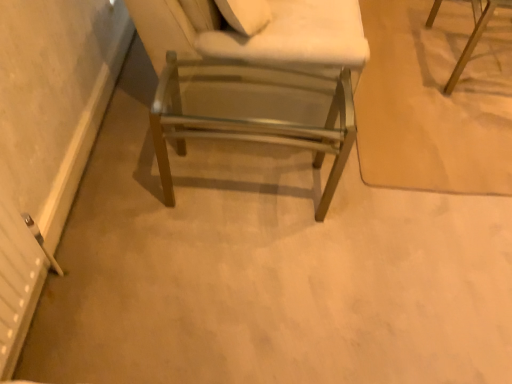
Question: Looking at the image, does wooden chair at upper right, the 2th chair in the left-to-right sequence, seem bigger or smaller compared to metallic silver chair at center, marked as the first chair in a left-to-right arrangement?

Choices:
 (A) small
 (B) big

Answer: (B)

Question: Based on their positions, is wooden chair at upper right, which is the 1th chair in top-to-bottom order, located to the left or right of metallic silver chair at center, placed as the second chair when sorted from back to front?

Choices:
 (A) left
 (B) right

Answer: (B)

Question: From a real-world perspective, is wooden chair at upper right, the second chair ordered from the bottom, physically located above or below metallic silver chair at center, placed as the second chair when sorted from back to front?

Choices:
 (A) above
 (B) below

Answer: (A)

Question: From a real-world perspective, is metallic silver chair at center, placed as the second chair when sorted from back to front, positioned above or below wooden chair at upper right, placed as the second chair when sorted from front to back?

Choices:
 (A) below
 (B) above

Answer: (A)

Question: In terms of size, does metallic silver chair at center, the first chair in the front-to-back sequence, appear bigger or smaller than wooden chair at upper right, placed as the second chair when sorted from front to back?

Choices:
 (A) big
 (B) small

Answer: (B)

Question: From their relative heights in the image, would you say metallic silver chair at center, placed as the second chair when sorted from back to front, is taller or shorter than wooden chair at upper right, the first chair viewed from the right?

Choices:
 (A) tall
 (B) short

Answer: (B)

Question: Is metallic silver chair at center, positioned as the second chair in right-to-left order, wider or thinner than wooden chair at upper right, the 1th chair positioned from the back?

Choices:
 (A) wide
 (B) thin

Answer: (A)